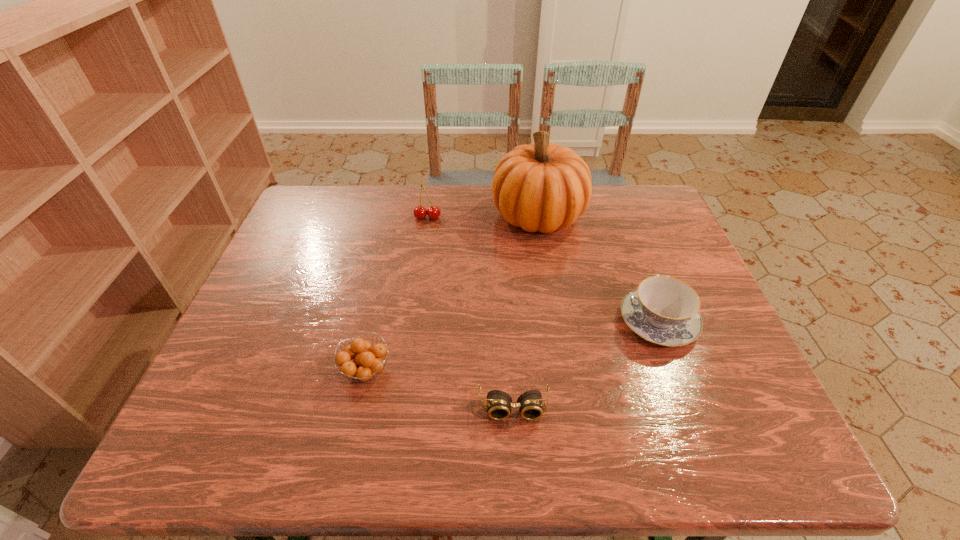
In the image, there is a desktop. At what (x,y) coordinates should I click in order to perform the action: click on vacant space at the near left corner. Please return your answer as a coordinate pair (x, y). Looking at the image, I should click on (216, 423).

Locate an element on the screen. free space between the rightmost object and the orange fruit is located at coordinates (512, 346).

Locate an element on the screen. free space between the shortest object and the chinaware is located at coordinates (586, 365).

Where is `unoccupied position between the fourth shortest object and the chinaware`? The image size is (960, 540). unoccupied position between the fourth shortest object and the chinaware is located at coordinates (542, 269).

Locate an element on the screen. The width and height of the screenshot is (960, 540). vacant space in between the pumpkin and the orange fruit is located at coordinates tap(452, 293).

Where is `vacant space that is in between the chinaware and the orange fruit`? The image size is (960, 540). vacant space that is in between the chinaware and the orange fruit is located at coordinates (512, 346).

The image size is (960, 540). Find the location of `free space between the orange fruit and the shortest object`. free space between the orange fruit and the shortest object is located at coordinates (440, 390).

This screenshot has height=540, width=960. I want to click on free space between the orange fruit and the chinaware, so click(512, 346).

At what (x,y) coordinates should I click in order to perform the action: click on free space between the orange fruit and the pumpkin. Please return your answer as a coordinate pair (x, y). This screenshot has width=960, height=540. Looking at the image, I should click on (452, 293).

At what (x,y) coordinates should I click in order to perform the action: click on free space between the shortest object and the chinaware. Please return your answer as a coordinate pair (x, y). The height and width of the screenshot is (540, 960). Looking at the image, I should click on (586, 365).